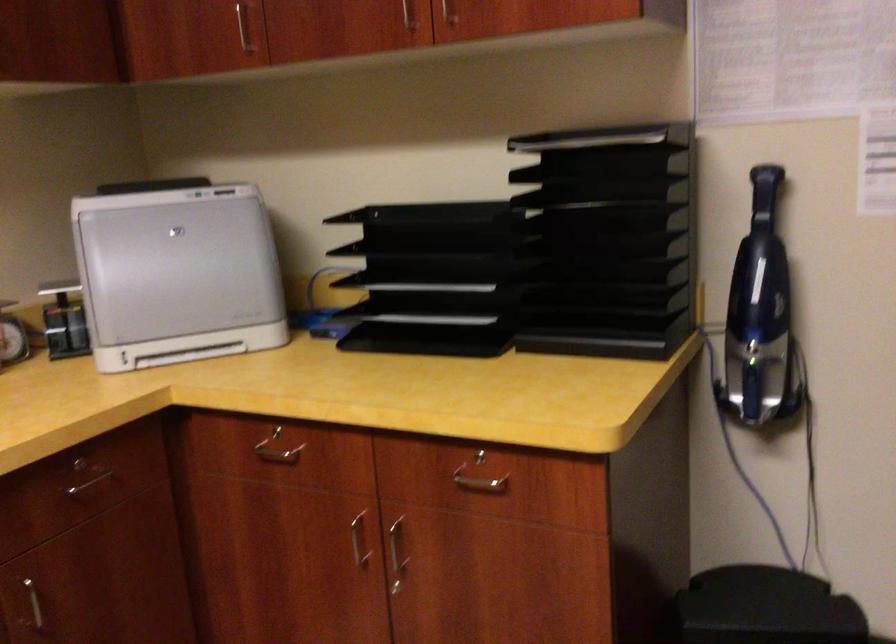
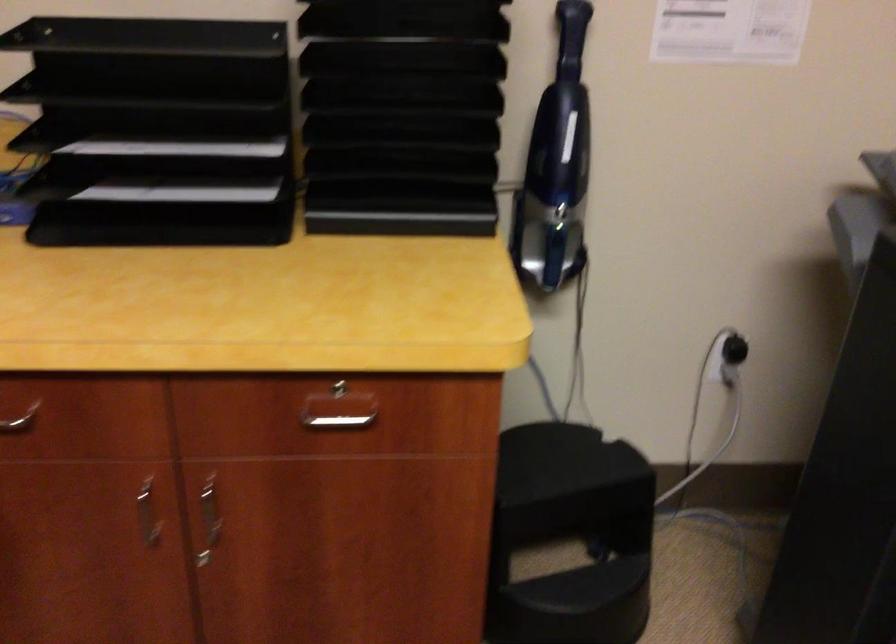
Locate, in the second image, the point that corresponds to (437,214) in the first image.

(151, 38)